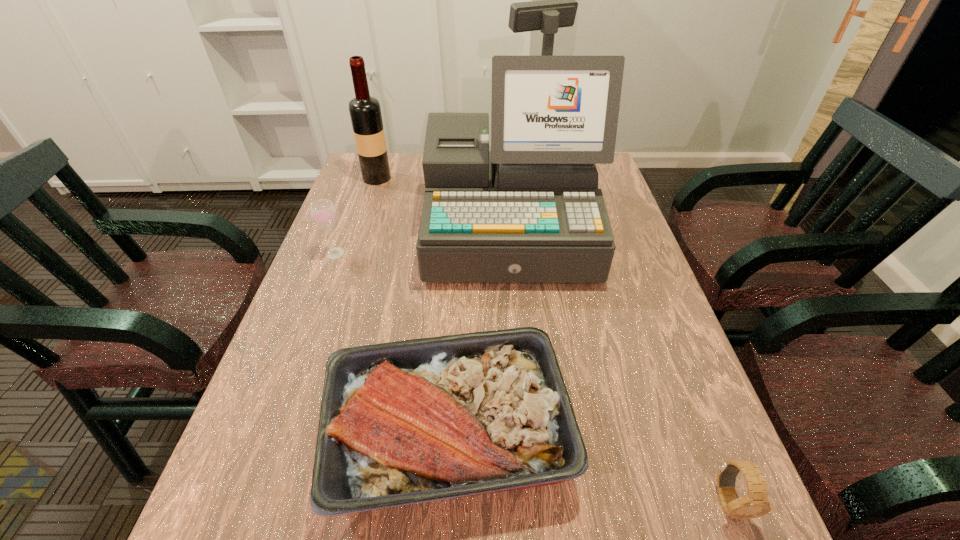
In order to click on object at the far right corner in this screenshot , I will do `click(529, 210)`.

Where is `free space at the left edge of the desktop`? free space at the left edge of the desktop is located at coordinates (366, 292).

Identify the location of free space at the right edge. (623, 321).

Locate an element on the screen. This screenshot has height=540, width=960. free point between the tallest object and the tray is located at coordinates (479, 331).

Find the location of `empty location between the shortest object and the tallest object`. empty location between the shortest object and the tallest object is located at coordinates (618, 364).

The image size is (960, 540). In order to click on free space that is in between the shortest object and the fourth shortest object in this screenshot , I will do `click(552, 339)`.

Locate an element on the screen. This screenshot has height=540, width=960. free spot between the cash register and the tray is located at coordinates (479, 331).

Locate an element on the screen. The image size is (960, 540). vacant area between the shortest object and the cash register is located at coordinates (618, 364).

Find the location of a particular element. vacant area that lies between the watch and the wine bottle is located at coordinates (552, 339).

Identify the location of free space between the watch and the wine bottle. (552, 339).